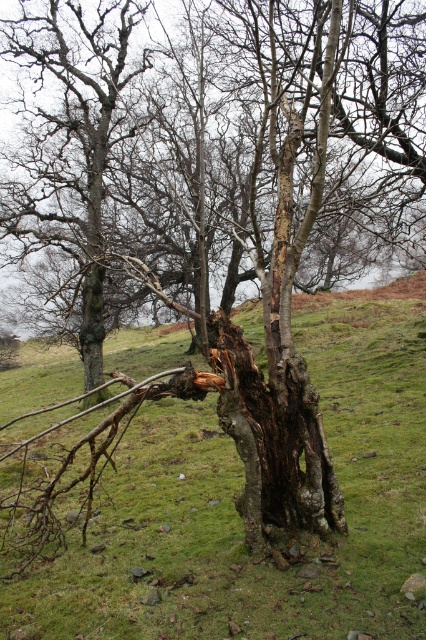
Which is above, green grassy at center or dark brown rough bark at center?

Positioned higher is green grassy at center.

Looking at this image, who is shorter, green grassy at center or dark brown rough bark at center?

dark brown rough bark at center is shorter.

Between point (149, 624) and point (253, 374), which one is positioned behind?

The point (253, 374) is more distant.

This screenshot has width=426, height=640. Identify the location of green grassy at center. (238, 515).